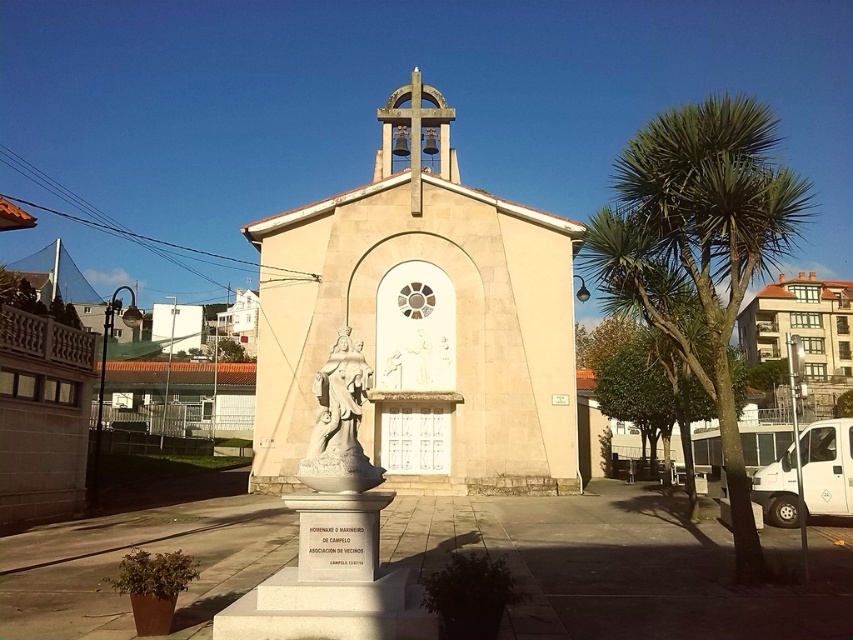
You are a tour guide leading a group to the beige stone chapel at center. You notice a beige stone church at center nearby. How far apart are these two structures?

The beige stone chapel at center and beige stone church at center are 26.52 meters apart.

You are standing in front of the chapel and want to place a 10 feet wide banner between the green leafy palm tree at right and the chapel entrance. Will there be enough space?

The distance between the green leafy palm tree at right and the chapel entrance is 23.15 feet, so a 10 feet wide banner can easily fit between them with plenty of space remaining.

You are an architect designing a new park layout and need to place both the beige stone chapel at center and the beige stone church at center. According to the image, which one requires more space for placement?

The beige stone church at center requires more space because it occupies more space than the beige stone chapel at center.